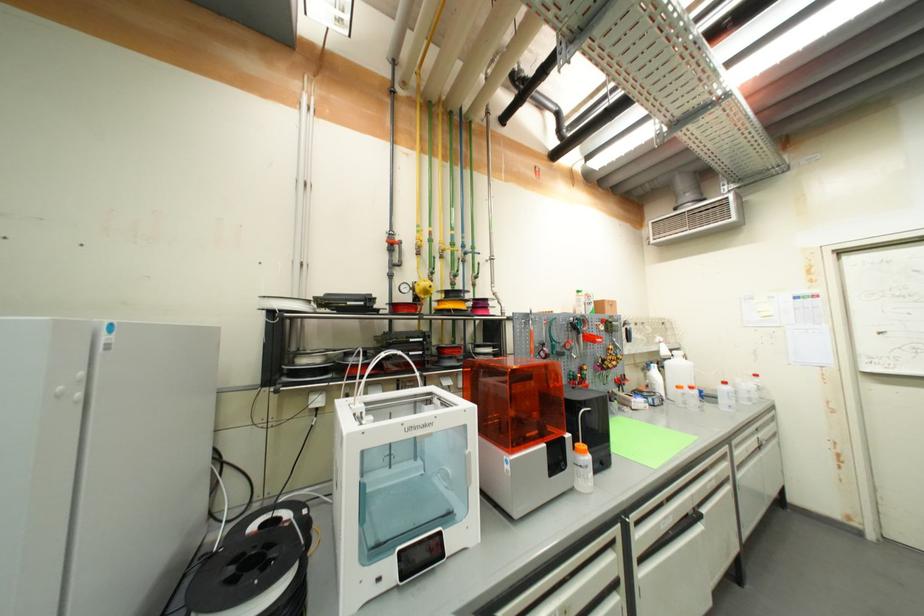
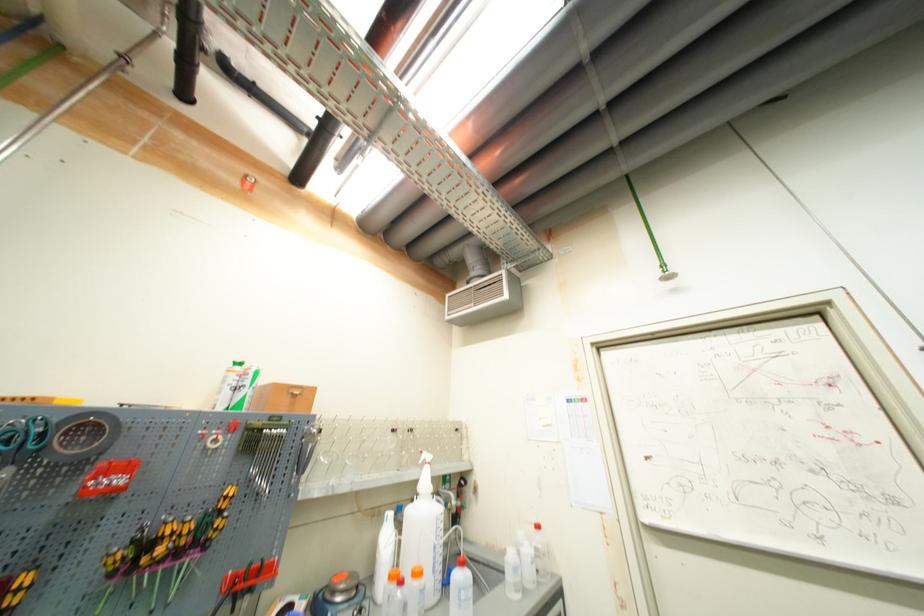
Find the pixel in the second image that matches pixel 773 400 in the first image.

(558, 578)